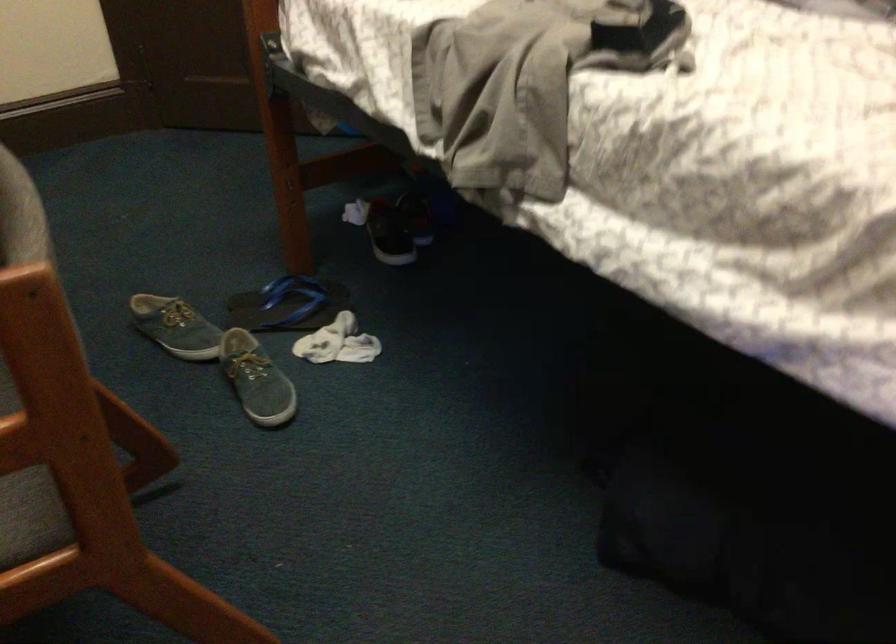
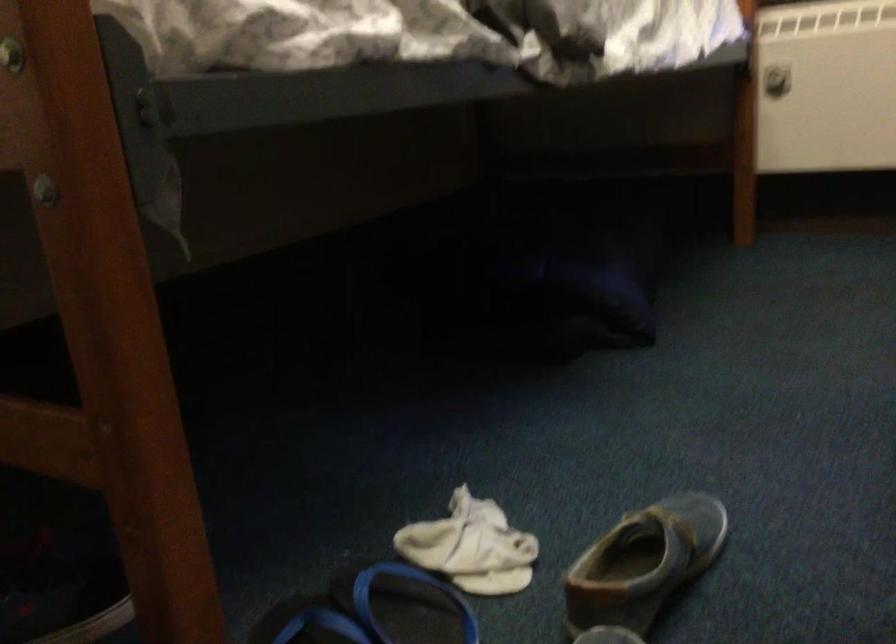
Question: I am providing you with two images of the same scene from different viewpoints. Please identify which objects are invisible in image2.

Choices:
 (A) blue flip-flop
 (B) radiator knob
 (C) grey slip-on shoe
 (D) none of these

Answer: (D)